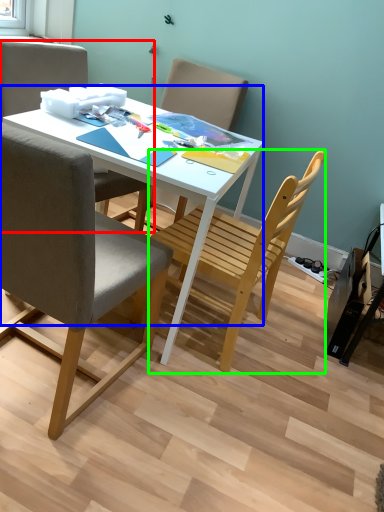
Question: Which object is the farthest from chair (highlighted by a red box)? Choose among these: desk (highlighted by a blue box) or chair (highlighted by a green box).

Choices:
 (A) desk
 (B) chair

Answer: (B)